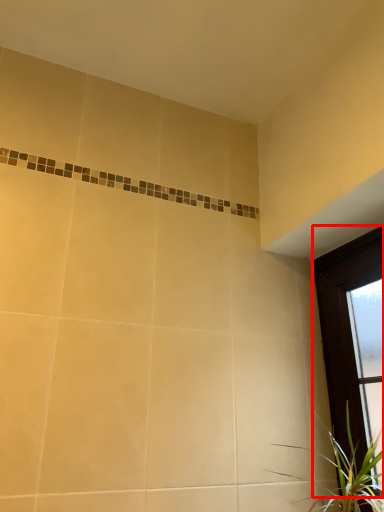
Question: From the image's perspective, what is the correct spatial relationship of window (annotated by the red box) in relation to houseplant?

Choices:
 (A) above
 (B) below

Answer: (A)